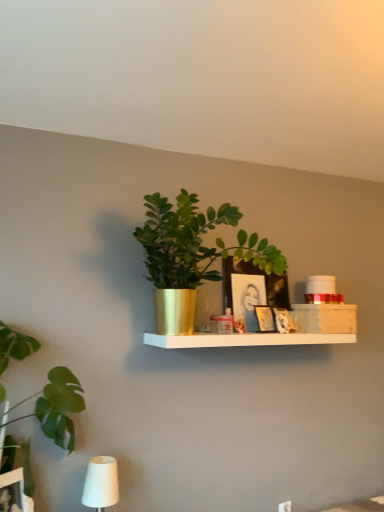
Question: In which direction should I rotate to look at gold metallic plant pot at center, which ranks as the 1th houseplant in right-to-left order?

Choices:
 (A) right
 (B) left

Answer: (A)

Question: From a real-world perspective, is white matte table lamp at lower left positioned under green leafy plant at left, positioned as the first houseplant in left-to-right order, based on gravity?

Choices:
 (A) yes
 (B) no

Answer: (A)

Question: Can we say white matte table lamp at lower left lies outside green leafy plant at left, positioned as the first houseplant in left-to-right order?

Choices:
 (A) yes
 (B) no

Answer: (A)

Question: Is white matte table lamp at lower left closer to the viewer compared to green leafy plant at left, arranged as the 2th houseplant when viewed from the right?

Choices:
 (A) no
 (B) yes

Answer: (A)

Question: Is white matte table lamp at lower left wider than green leafy plant at left, positioned as the first houseplant in left-to-right order?

Choices:
 (A) yes
 (B) no

Answer: (B)

Question: Would you consider white matte table lamp at lower left to be distant from green leafy plant at left, arranged as the 2th houseplant when viewed from the right?

Choices:
 (A) yes
 (B) no

Answer: (B)

Question: From a real-world perspective, is white matte table lamp at lower left on top of green leafy plant at left, arranged as the 2th houseplant when viewed from the right?

Choices:
 (A) no
 (B) yes

Answer: (A)

Question: Would you say green leafy plant at left, arranged as the 2th houseplant when viewed from the right, is a long distance from matte black picture frame at center, which is the third picture frame in front-to-back order?

Choices:
 (A) yes
 (B) no

Answer: (B)

Question: From a real-world perspective, is green leafy plant at left, arranged as the 2th houseplant when viewed from the right, located higher than matte black picture frame at center, acting as the 2th picture frame starting from the back?

Choices:
 (A) yes
 (B) no

Answer: (B)

Question: Can you confirm if green leafy plant at left, arranged as the 2th houseplant when viewed from the right, is positioned to the left of matte black picture frame at center, which is the third picture frame in front-to-back order?

Choices:
 (A) yes
 (B) no

Answer: (A)

Question: Is green leafy plant at left, positioned as the first houseplant in left-to-right order, wider than matte black picture frame at center, which is the third picture frame in front-to-back order?

Choices:
 (A) yes
 (B) no

Answer: (A)

Question: From the image's perspective, is green leafy plant at left, positioned as the first houseplant in left-to-right order, under matte black picture frame at center, acting as the 2th picture frame starting from the back?

Choices:
 (A) no
 (B) yes

Answer: (B)

Question: Is green leafy plant at left, positioned as the first houseplant in left-to-right order, facing away from matte black picture frame at center, acting as the 2th picture frame starting from the back?

Choices:
 (A) no
 (B) yes

Answer: (A)

Question: Is wooden picture frame at center, placed as the 4th picture frame when sorted from back to front, in contact with white matte table lamp at lower left?

Choices:
 (A) yes
 (B) no

Answer: (B)